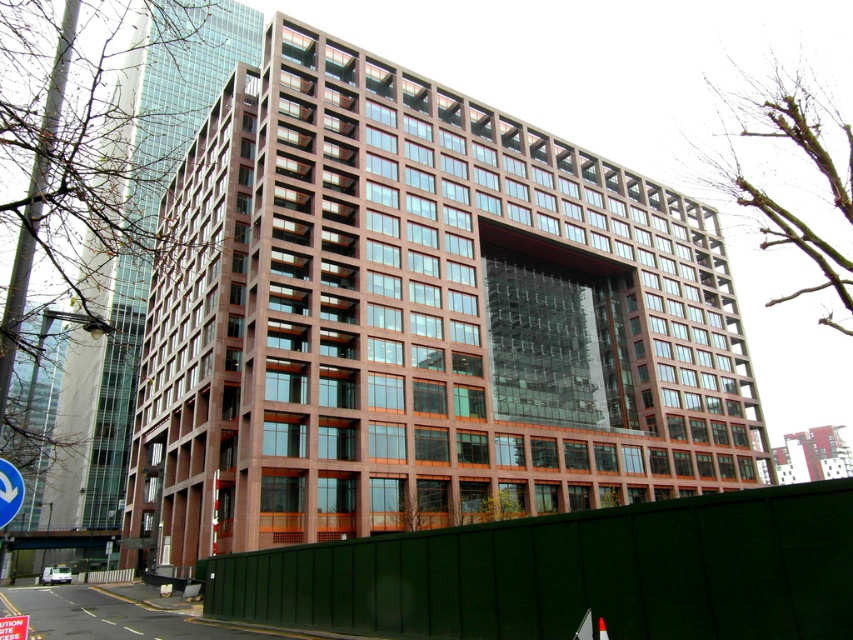
Based on the photo, can you confirm if metallic silver arrow at center is shorter than metallic reflective traffic sign at center?

Yes, metallic silver arrow at center is shorter than metallic reflective traffic sign at center.

Is point (13, 476) closer to camera compared to point (20, 627)?

Yes, it is.

Locate an element on the screen. The height and width of the screenshot is (640, 853). metallic silver arrow at center is located at coordinates (9, 492).